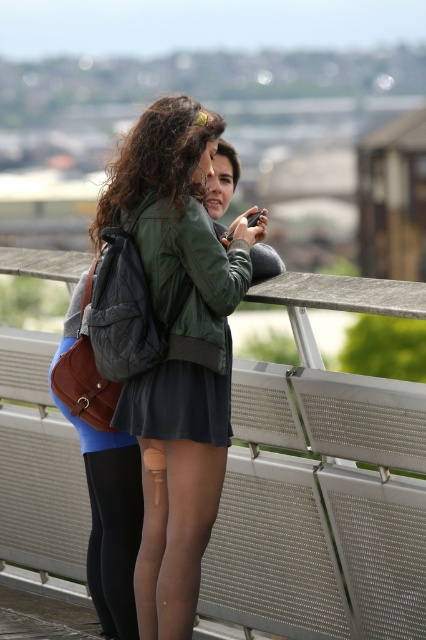
You are a fashion designer observing the two outfits in the image. The matte green bomber jacket at center and the dark gray matte dress at center are part of a new collection. Which outfit would you recommend to a client who wants to appear taller?

The matte green bomber jacket at center is taller than the dark gray matte dress at center, so it would be the better choice for someone wanting to appear taller.

You are a photographer trying to capture a candid shot of two people interacting near a railing. You notice the matte green bomber jacket at center and the metallic gray balustrade at center. Which object is closer to your camera lens?

The matte green bomber jacket at center is closer to the camera lens because it is positioned further to the viewer compared to the metallic gray balustrade at center.

You are a fashion designer observing the scene. You need to decide which item, the metallic gray balustrade at center or the dark gray matte dress at center, has a greater width. Which one is wider?

The metallic gray balustrade at center is wider than the dark gray matte dress at center according to the description provided.